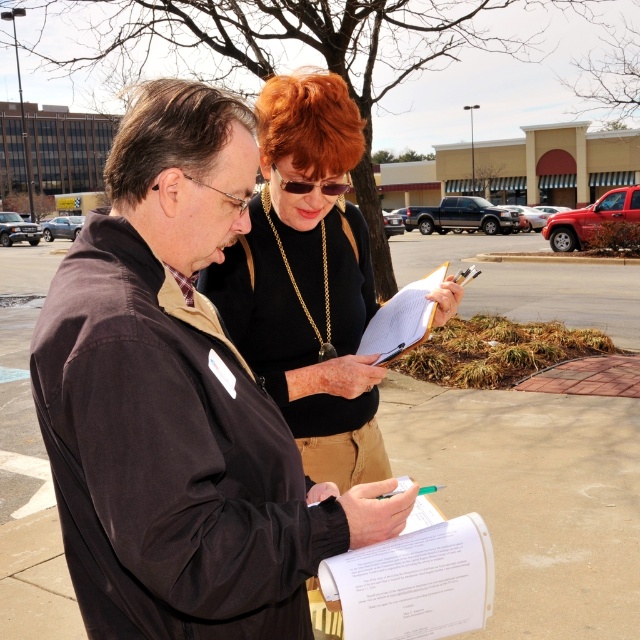
You are a delivery person who needs to check the delivery address on the white paper at center and the white paper clipboard at center. Which object should you pick up first to access the delivery address?

The white paper at center is positioned under the white paper clipboard at center, so you should pick up the white paper clipboard at center first to access the delivery address without disturbing the white paper underneath.

You are a delivery robot with a 60 cm wide package. You need to pass between the dark brown jacket at center and the black matte shirt at center. Can you fit through the space between them?

The distance between the dark brown jacket at center and the black matte shirt at center is 52.92 centimeters. Since the package is 60 cm wide, it is wider than the available space, so the robot cannot fit through the space between them.